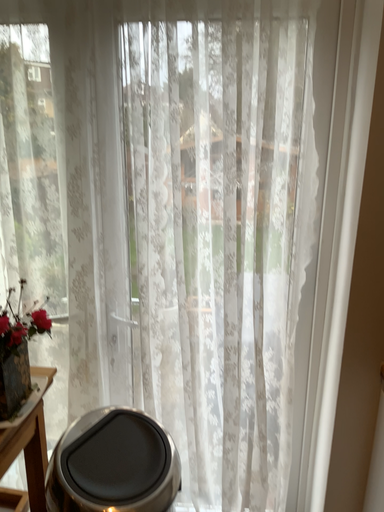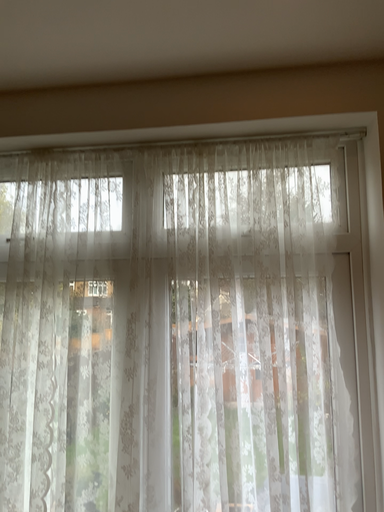
Question: How did the camera likely rotate when shooting the video?

Choices:
 (A) rotated downward
 (B) rotated upward

Answer: (B)